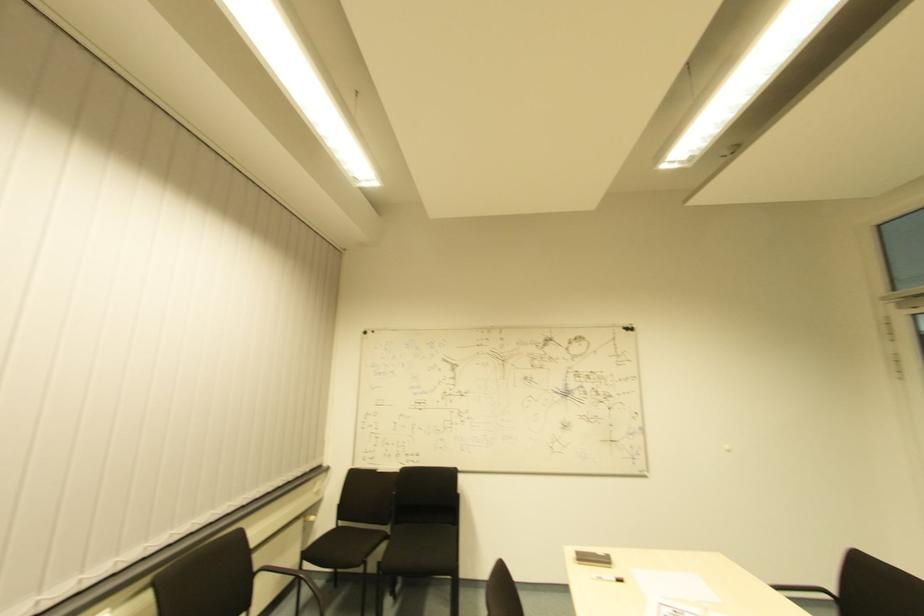
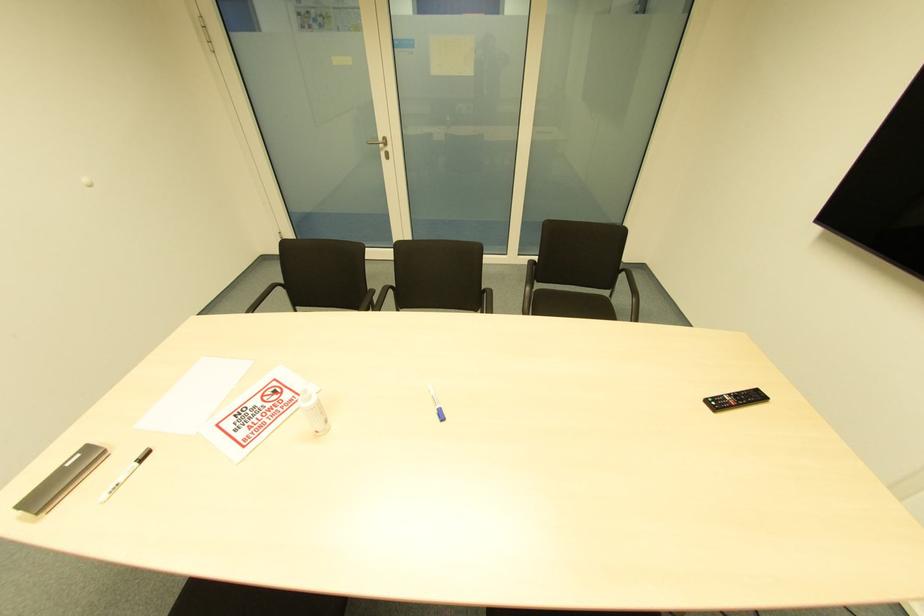
How did the camera likely rotate?

The camera's rotation is toward right-down.